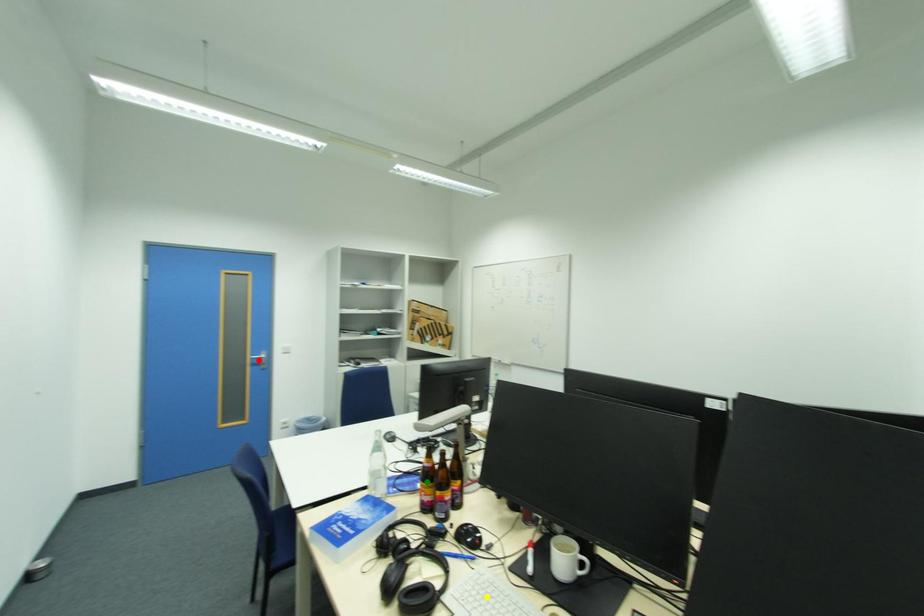
Order these from nearest to farthest:
A) green point
B) yellow point
C) red point

yellow point < green point < red point